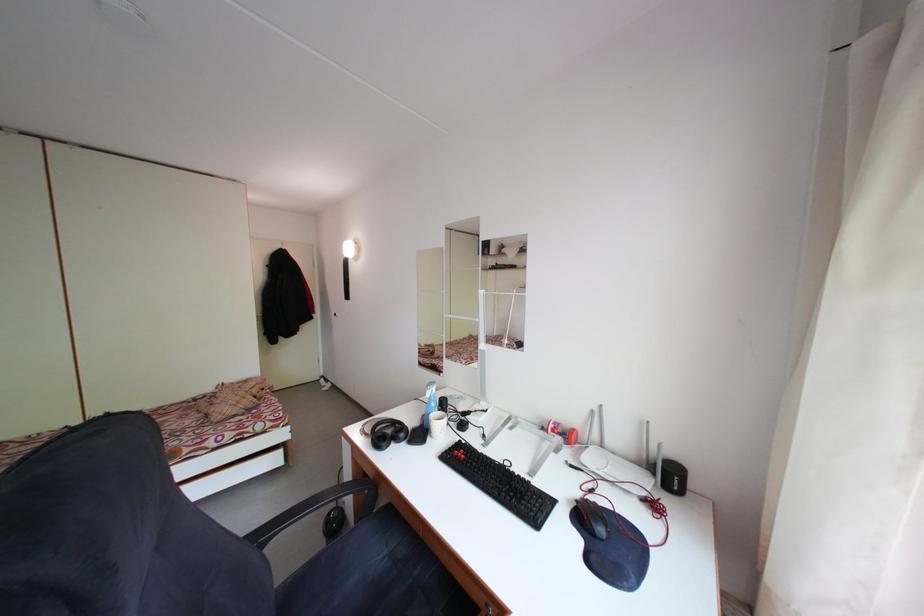
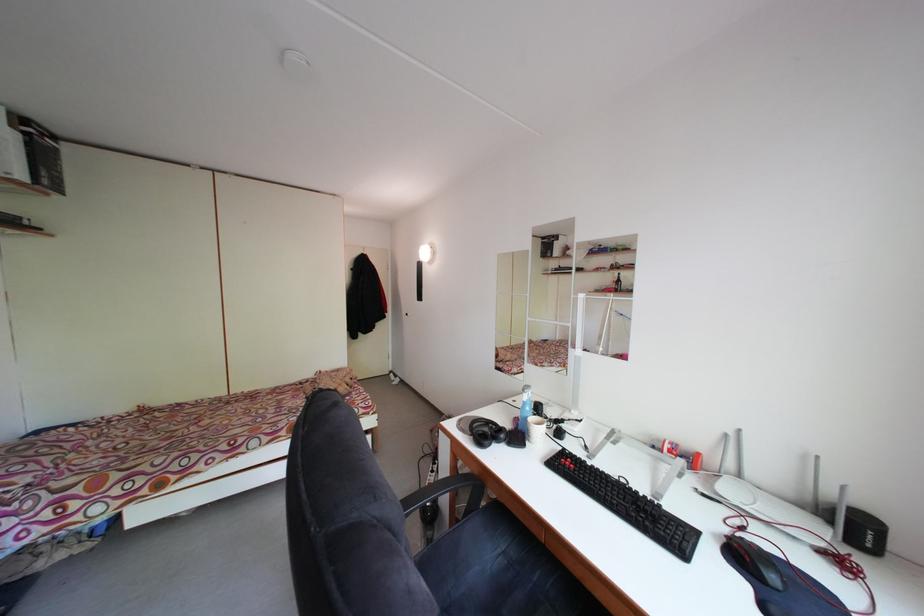
Question: Which direction would the cameraman need to move to produce the second image? Reply with the corresponding letter.

Choices:
 (A) Left
 (B) Right
 (C) Forward
 (D) Backward

Answer: (A)